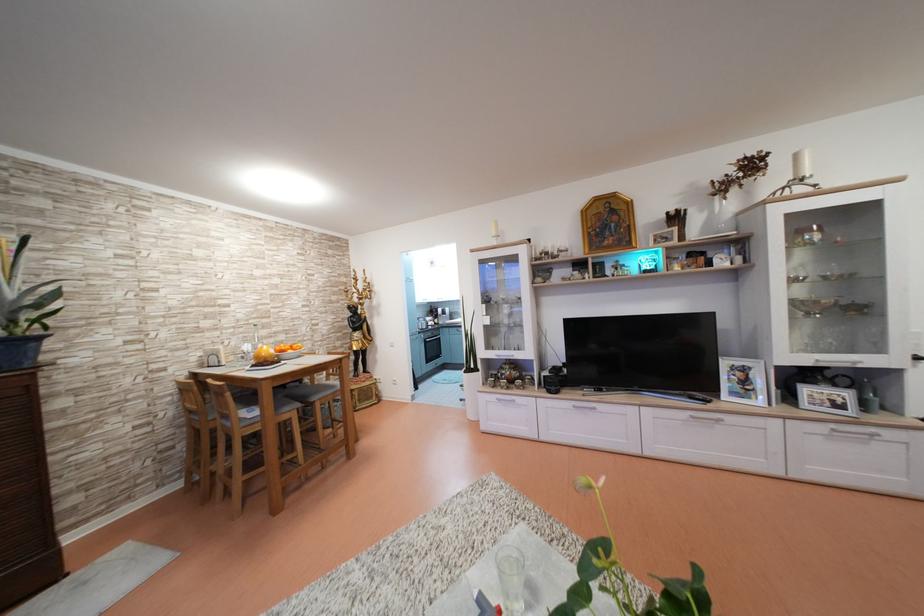
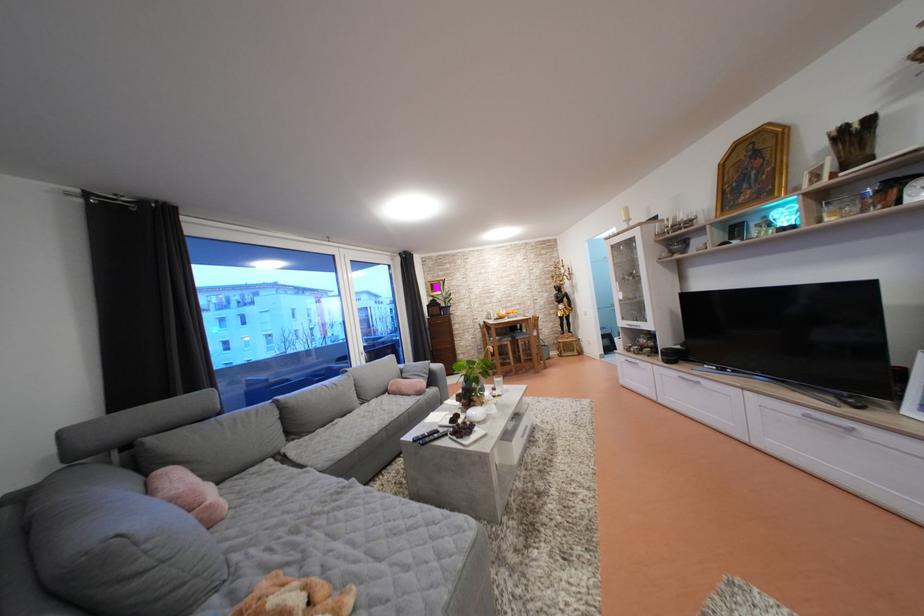
In the second image, find the point that corresponds to [93,492] in the first image.

(470, 359)